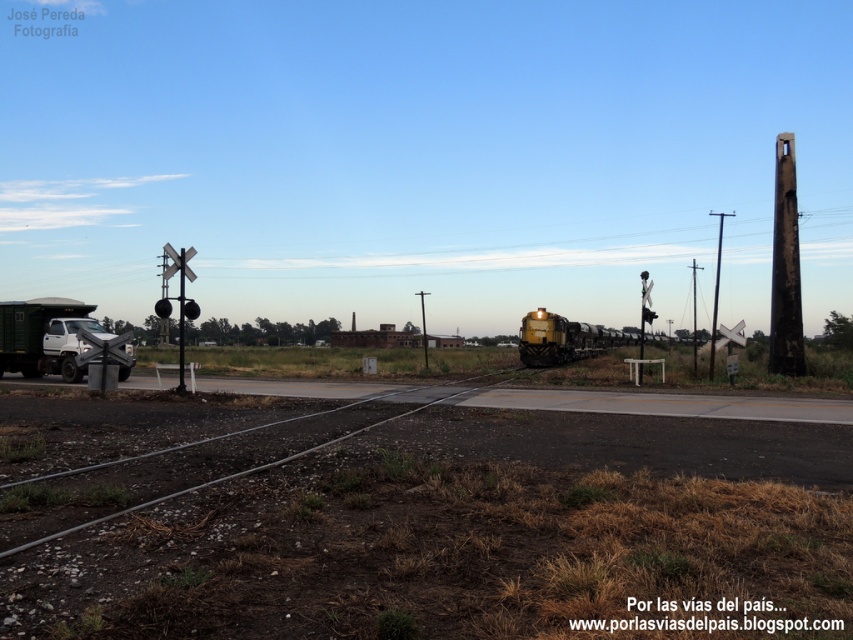
The image size is (853, 640). Describe the element at coordinates (785, 268) in the screenshot. I see `charcoal textured pole at right` at that location.

Locate an element on the screen. The height and width of the screenshot is (640, 853). charcoal textured pole at right is located at coordinates (785, 268).

Which is behind, point (785, 234) or point (712, 358)?

Point (785, 234)

What do you see at coordinates (785, 268) in the screenshot? Image resolution: width=853 pixels, height=640 pixels. I see `charcoal textured pole at right` at bounding box center [785, 268].

The height and width of the screenshot is (640, 853). In order to click on charcoal textured pole at right in this screenshot , I will do pos(785,268).

Which is more to the left, charcoal textured pole at right or brushed metal pole at left?

Positioned to the left is brushed metal pole at left.

Who is more distant from viewer, (782, 300) or (178, 326)?

Point (782, 300)

This screenshot has height=640, width=853. What do you see at coordinates (785, 268) in the screenshot?
I see `charcoal textured pole at right` at bounding box center [785, 268].

You are a GUI agent. You are given a task and a screenshot of the screen. Output one action in this format:
    pyautogui.click(x=<x>, y=<y>)
    Task: Click on the charcoal textured pole at right
    This screenshot has height=640, width=853.
    Given the screenshot: What is the action you would take?
    pyautogui.click(x=785, y=268)